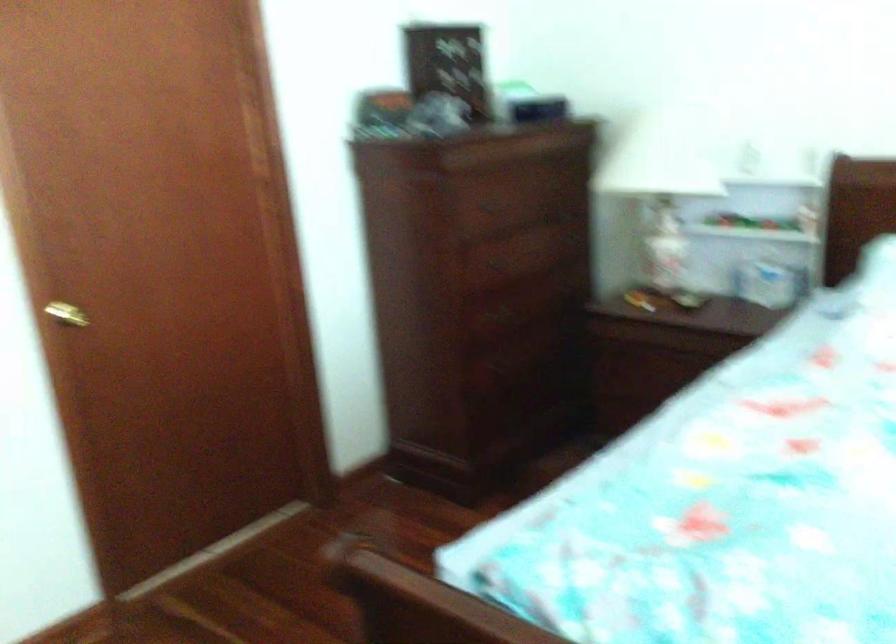
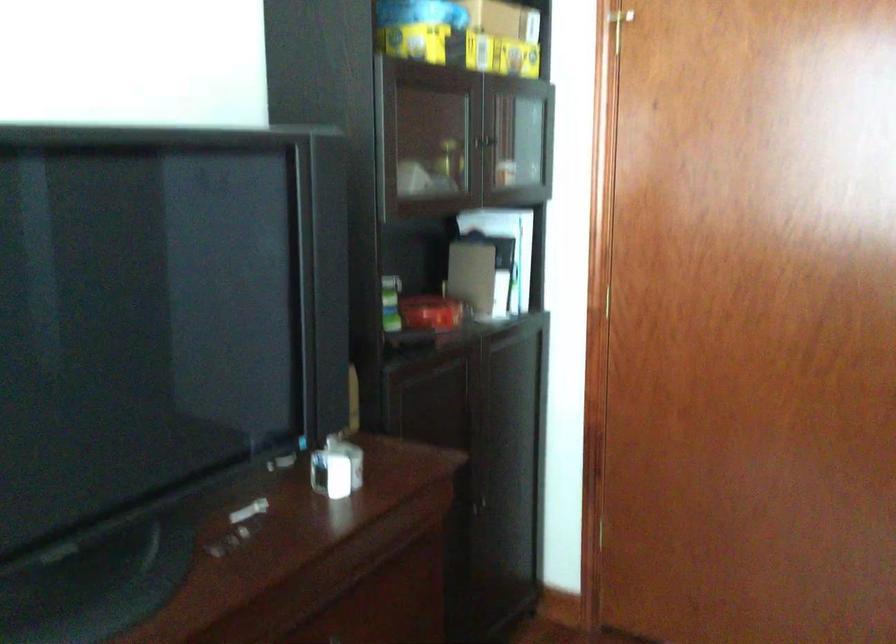
Question: Based on the continuous images, in which direction is the camera rotating? Reply with the corresponding letter.

Choices:
 (A) Left
 (B) Right
 (C) Up
 (D) Down

Answer: (A)